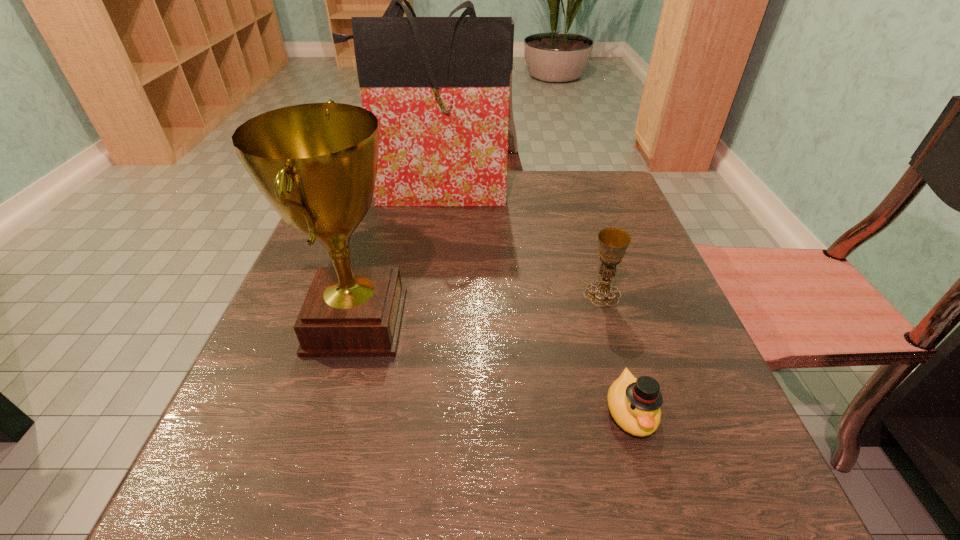
The image size is (960, 540). Find the location of `free spot between the duck and the chalice`. free spot between the duck and the chalice is located at coordinates (616, 353).

This screenshot has height=540, width=960. I want to click on the closest object to the shopping bag, so click(x=316, y=164).

Locate an element on the screen. This screenshot has height=540, width=960. object that is the closest to the shortest object is located at coordinates (613, 242).

Locate an element on the screen. The height and width of the screenshot is (540, 960). free spot that satisfies the following two spatial constraints: 1. on the front side of the third tallest object; 2. on the right side of the farthest object is located at coordinates (418, 294).

Where is `vacant space that satisfies the following two spatial constraints: 1. on the front side of the chalice; 2. on the plaque of the award`? The height and width of the screenshot is (540, 960). vacant space that satisfies the following two spatial constraints: 1. on the front side of the chalice; 2. on the plaque of the award is located at coordinates (611, 322).